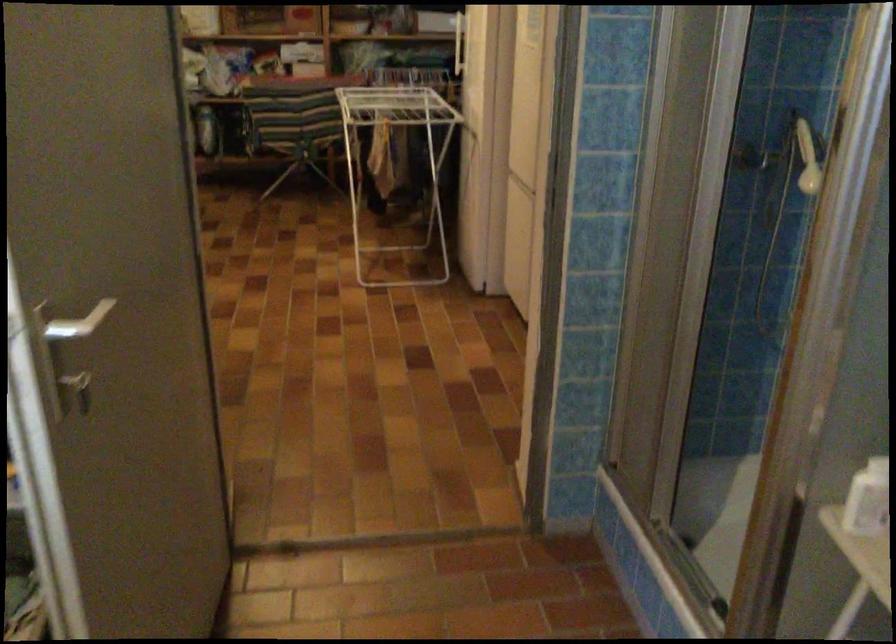
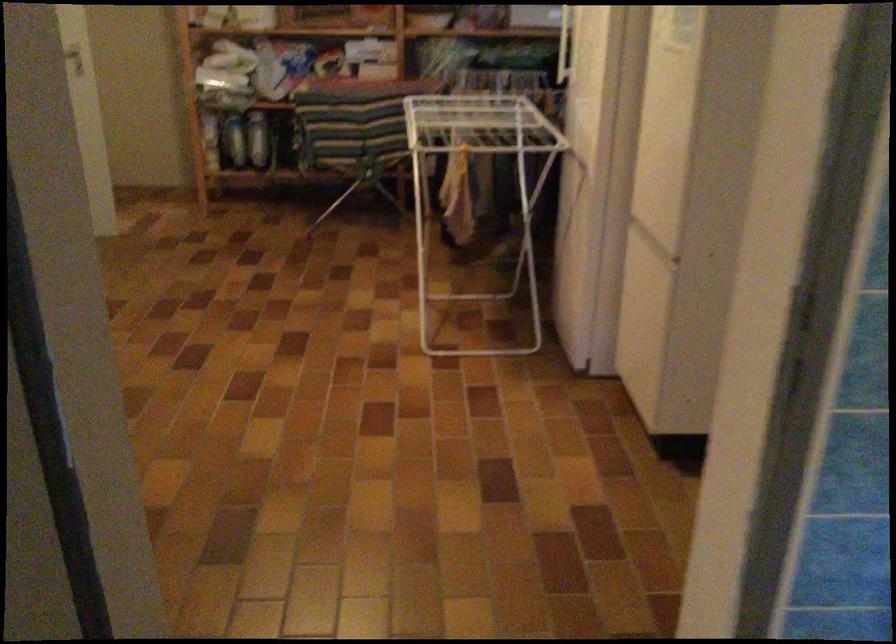
Question: The camera is either moving clockwise (left) or counter-clockwise (right) around the object. The first image is from the beginning of the video and the second image is from the end. Is the camera moving left or right when shooting the video?

Choices:
 (A) Left
 (B) Right

Answer: (B)